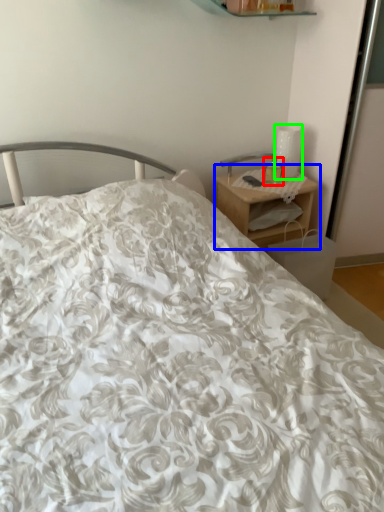
Question: Considering the real-world distances, which object is farthest from candle holder (highlighted by a red box)? nightstand (highlighted by a blue box) or table lamp (highlighted by a green box)?

Choices:
 (A) nightstand
 (B) table lamp

Answer: (A)